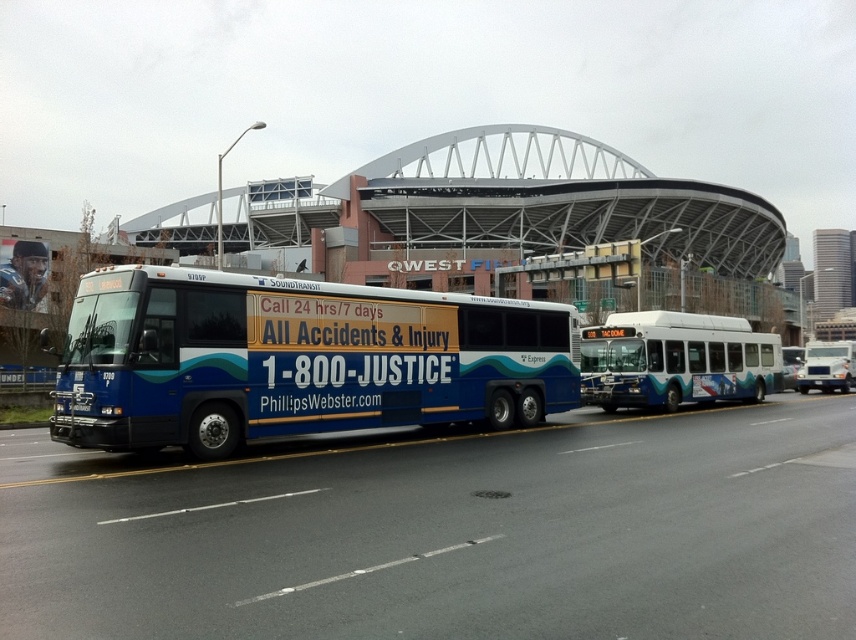
Question: Which point appears closest to the camera in this image?

Choices:
 (A) (807, 355)
 (B) (736, 324)
 (C) (158, 326)

Answer: (C)

Question: Observing the image, what is the correct spatial positioning of blue metallic bus at center in reference to white matte truck at center?

Choices:
 (A) left
 (B) right

Answer: (A)

Question: Which of the following is the closest to the observer?

Choices:
 (A) white glossy bus at center
 (B) blue metallic bus at center

Answer: (B)

Question: Based on their relative distances, which object is farther from the white matte truck at center?

Choices:
 (A) blue metallic bus at center
 (B) white glossy bus at center

Answer: (A)

Question: Does blue metallic bus at center have a greater width compared to white matte truck at center?

Choices:
 (A) no
 (B) yes

Answer: (A)

Question: Where is blue metallic bus at center located in relation to white matte truck at center in the image?

Choices:
 (A) below
 (B) above

Answer: (B)